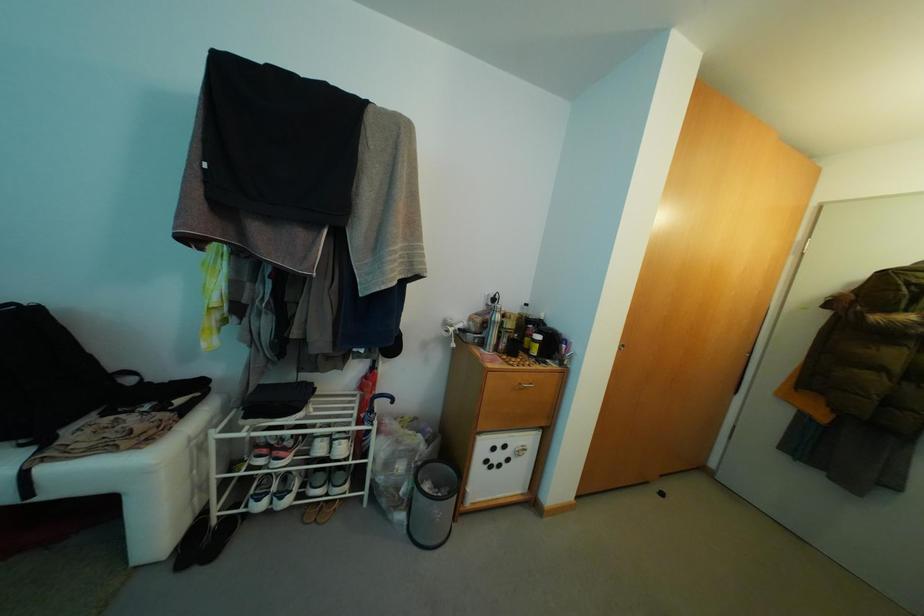
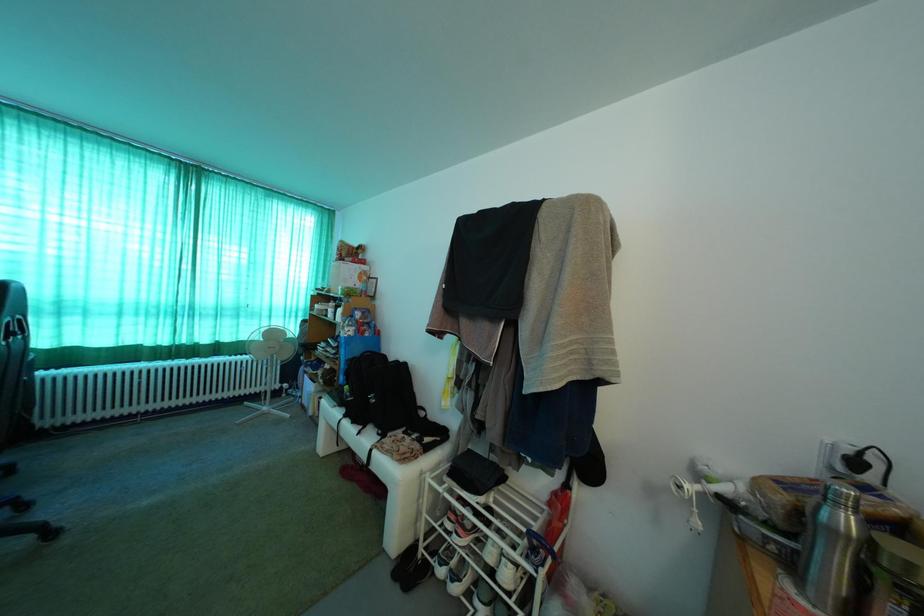
Question: The camera is either moving clockwise (left) or counter-clockwise (right) around the object. The first image is from the beginning of the video and the second image is from the end. Is the camera moving left or right when shooting the video?

Choices:
 (A) Left
 (B) Right

Answer: (B)